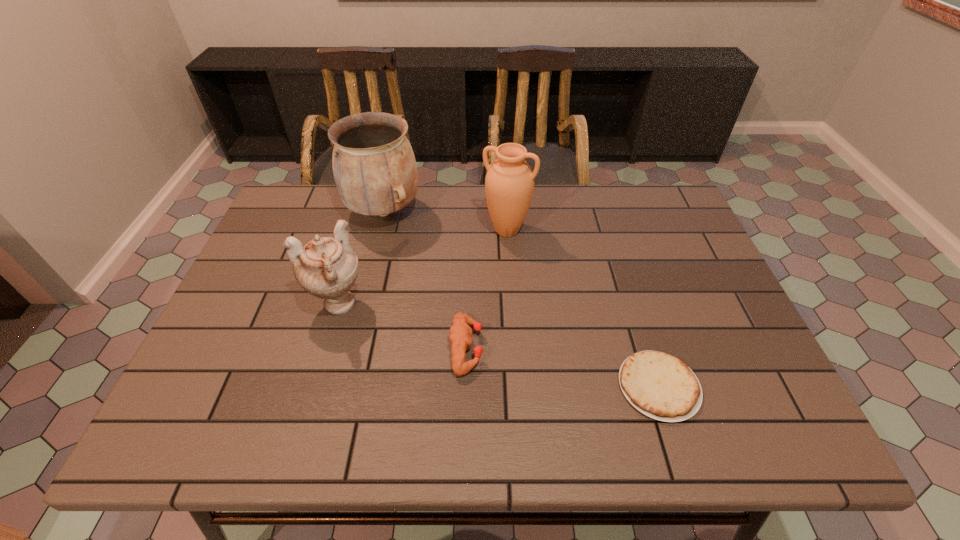
Identify the location of vacant point located 0.240m on the left of the shortest object. (507, 386).

Where is `object positioned at the near edge`? object positioned at the near edge is located at coordinates (661, 386).

Locate an element on the screen. Image resolution: width=960 pixels, height=540 pixels. object positioned at the right edge is located at coordinates (661, 386).

Identify the location of object at the near right corner. The width and height of the screenshot is (960, 540). (661, 386).

Image resolution: width=960 pixels, height=540 pixels. I want to click on free location at the far edge of the desktop, so click(420, 199).

Locate an element on the screen. The height and width of the screenshot is (540, 960). free location at the left edge is located at coordinates (274, 243).

You are a GUI agent. You are given a task and a screenshot of the screen. Output one action in this format:
    pyautogui.click(x=<x>, y=<y>)
    Task: Click on the vacant space at the right edge of the desktop
    This screenshot has width=960, height=540.
    Given the screenshot: What is the action you would take?
    pos(669,292)

This screenshot has width=960, height=540. I want to click on vacant region at the near left corner of the desktop, so click(x=192, y=409).

Identify the location of free space between the nearest urn and the fourth object from left to right. (422, 268).

Locate an element on the screen. This screenshot has height=540, width=960. empty location between the rightmost object and the fourth tallest object is located at coordinates (563, 367).